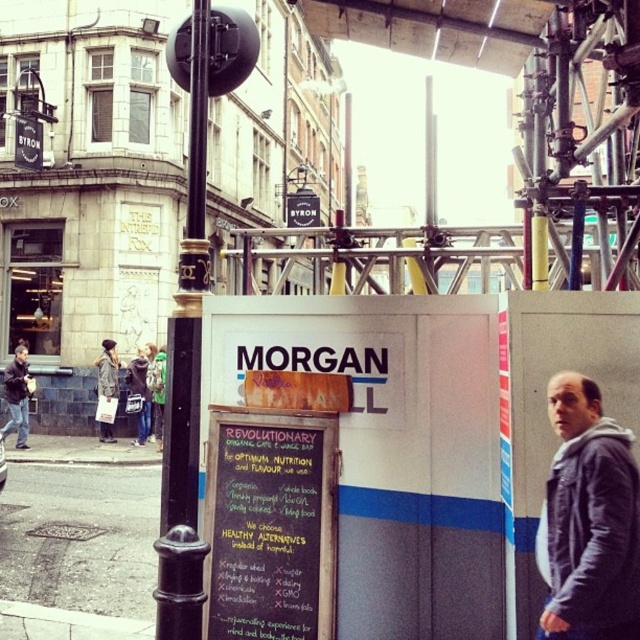
You are a photographer standing in the urban street scene. You want to take a photo of the dark gray hoodie at right while keeping the camera in your hand. Is the distance between them sufficient for you to hold the camera and capture the hoodie without moving closer?

The dark gray hoodie at right and camera are 9.34 feet apart from each other. Since 9.34 feet is a reasonable distance for a photographer to hold the camera and capture the hoodie without needing to move closer, the distance is sufficient.

You are a pedestrian walking down the street and want to read the chalkboard sign at center. However, there is a dark gray hoodie at right blocking your view. Can you move around the sign to see it better?

The dark gray hoodie at right is behind the chalkboard sign at center, so you can move to the side of the sign to see it clearly without obstruction from the hoodie.